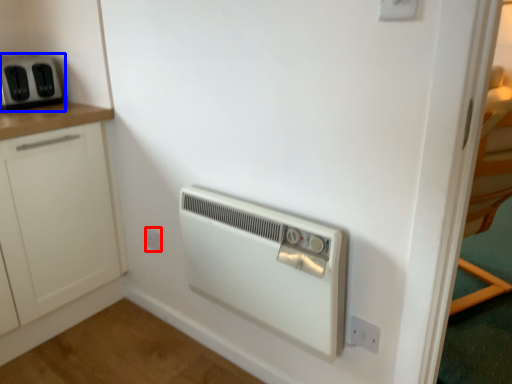
Question: Which object is further to the camera taking this photo, electric outlet (highlighted by a red box) or home appliance (highlighted by a blue box)?

Choices:
 (A) electric outlet
 (B) home appliance

Answer: (A)